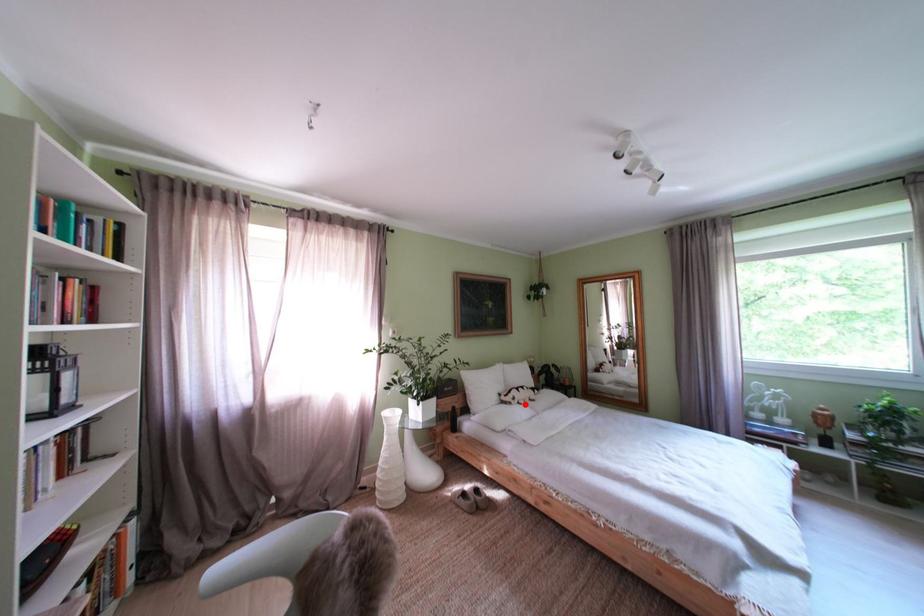
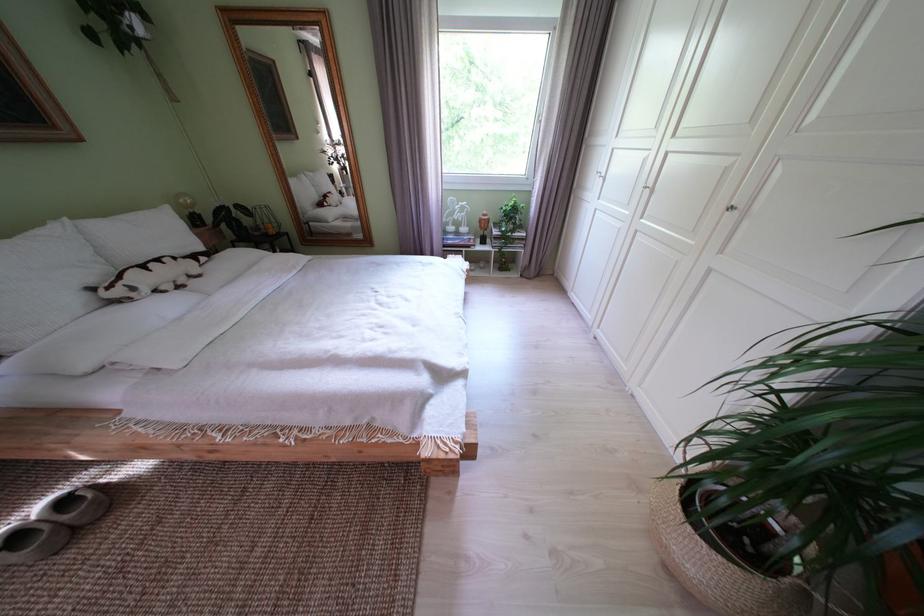
The point at the highlighted location is marked in the first image. Where is the corresponding point in the second image?

(146, 294)